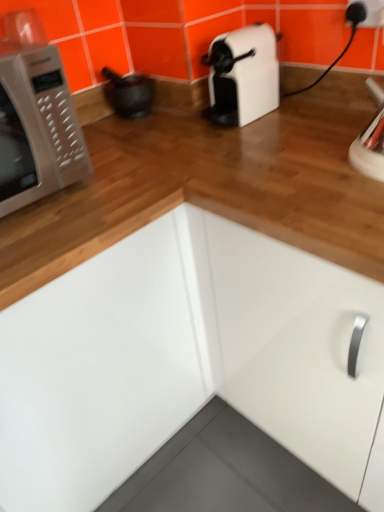
Question: Considering the positions of matte black mortar at upper left and white plastic electric outlet at upper right in the image, is matte black mortar at upper left bigger or smaller than white plastic electric outlet at upper right?

Choices:
 (A) small
 (B) big

Answer: (B)

Question: From a real-world perspective, is matte black mortar at upper left physically located above or below white plastic electric outlet at upper right?

Choices:
 (A) above
 (B) below

Answer: (B)

Question: Which object is positioned farthest from the white glossy microwave oven at left?

Choices:
 (A) white plastic electric outlet at upper right
 (B) white glossy cabinet at center
 (C) matte black mortar at upper left

Answer: (A)

Question: Based on their relative distances, which object is farther from the white plastic electric outlet at upper right?

Choices:
 (A) white glossy cabinet at center
 (B) matte black mortar at upper left
 (C) white glossy microwave oven at left

Answer: (A)